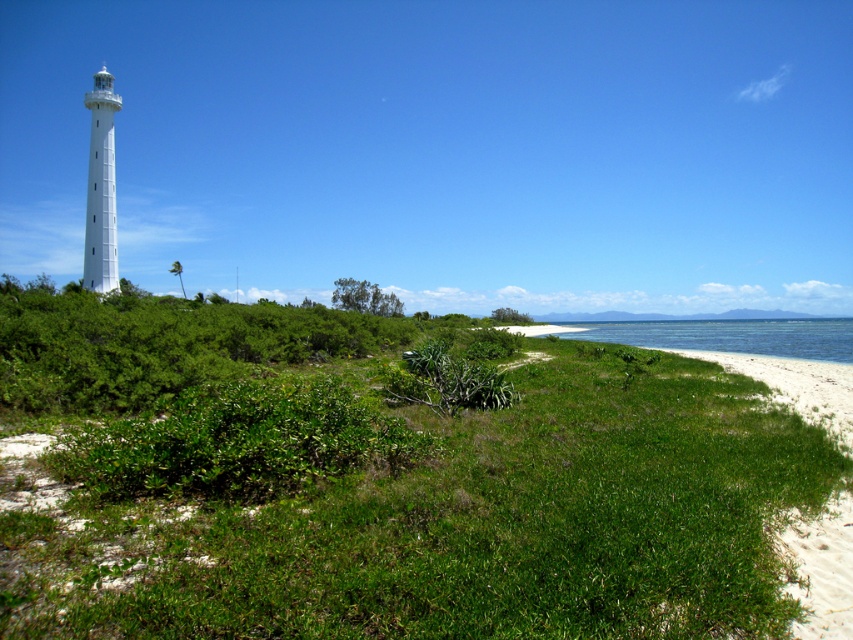
Question: Among these objects, which one is farthest from the camera?

Choices:
 (A) green leafy shrubs at center
 (B) white smooth lighthouse at left

Answer: (B)

Question: Which of these objects is positioned farthest from the green leafy shrubs at center?

Choices:
 (A) white smooth lighthouse at left
 (B) green leafy grass at center
 (C) clear blue water at lower right

Answer: (C)

Question: Among these points, which one is farthest from the camera?

Choices:
 (A) tap(788, 332)
 (B) tap(106, 394)

Answer: (A)

Question: Can you confirm if green leafy grass at center is smaller than white smooth lighthouse at left?

Choices:
 (A) no
 (B) yes

Answer: (B)

Question: Does green leafy grass at center have a smaller size compared to clear blue water at lower right?

Choices:
 (A) yes
 (B) no

Answer: (A)

Question: Does green leafy grass at center have a larger size compared to white smooth lighthouse at left?

Choices:
 (A) no
 (B) yes

Answer: (A)